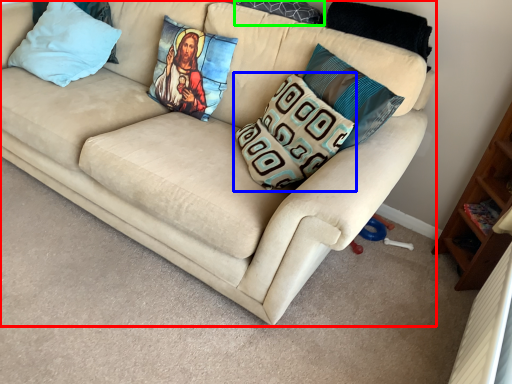
Question: Estimate the real-world distances between objects in this image. Which object is closer to studio couch (highlighted by a red box), pillow (highlighted by a blue box) or pillow (highlighted by a green box)?

Choices:
 (A) pillow
 (B) pillow

Answer: (A)